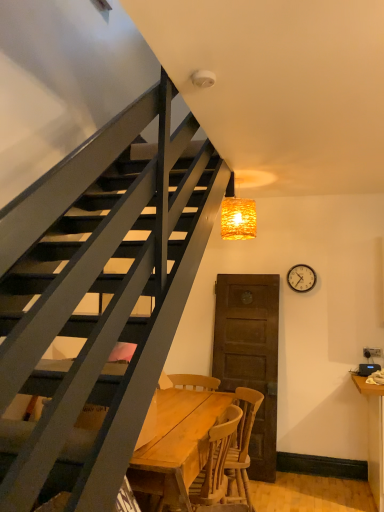
Question: Could you tell me if metallic silver clock at upper right is turned towards woven golden light at upper center?

Choices:
 (A) yes
 (B) no

Answer: (B)

Question: From a real-world perspective, does metallic silver clock at upper right sit lower than woven golden light at upper center?

Choices:
 (A) yes
 (B) no

Answer: (A)

Question: From a real-world perspective, does metallic silver clock at upper right stand above woven golden light at upper center?

Choices:
 (A) no
 (B) yes

Answer: (A)

Question: Can you confirm if metallic silver clock at upper right is bigger than woven golden light at upper center?

Choices:
 (A) no
 (B) yes

Answer: (A)

Question: Is metallic silver clock at upper right turned away from woven golden light at upper center?

Choices:
 (A) no
 (B) yes

Answer: (A)

Question: Considering the relative positions of metallic silver clock at upper right and woven golden light at upper center in the image provided, is metallic silver clock at upper right behind woven golden light at upper center?

Choices:
 (A) no
 (B) yes

Answer: (B)

Question: Is wooden table at center positioned in front of metallic silver clock at upper right?

Choices:
 (A) yes
 (B) no

Answer: (A)

Question: Does wooden table at center appear on the left side of metallic silver clock at upper right?

Choices:
 (A) no
 (B) yes

Answer: (B)

Question: Is wooden table at center next to metallic silver clock at upper right and touching it?

Choices:
 (A) no
 (B) yes

Answer: (A)

Question: Is wooden table at center at the right side of metallic silver clock at upper right?

Choices:
 (A) no
 (B) yes

Answer: (A)

Question: Is wooden table at center located outside metallic silver clock at upper right?

Choices:
 (A) yes
 (B) no

Answer: (A)

Question: Is wooden table at center positioned far away from metallic silver clock at upper right?

Choices:
 (A) no
 (B) yes

Answer: (B)

Question: From the image's perspective, is wooden table at center below woven golden light at upper center?

Choices:
 (A) no
 (B) yes

Answer: (B)